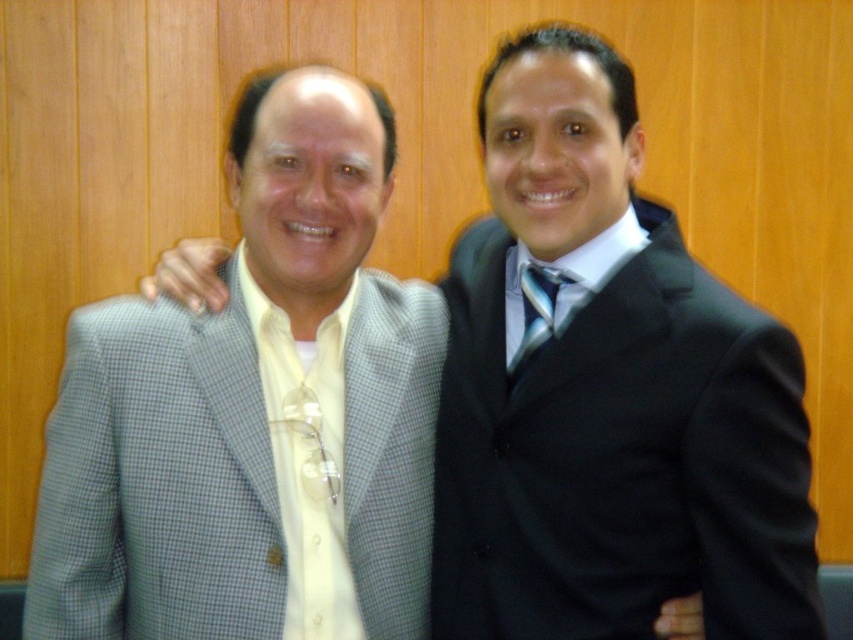
Is point (378, 205) closer to viewer compared to point (503, 499)?

No, it is behind (503, 499).

Can you confirm if gray checkered suit at left is thinner than black satin suit at right?

Incorrect, gray checkered suit at left's width is not less than black satin suit at right's.

Is point (90, 381) closer to viewer compared to point (675, 234)?

Yes, point (90, 381) is in front of point (675, 234).

The width and height of the screenshot is (853, 640). In order to click on gray checkered suit at left in this screenshot , I will do `click(254, 412)`.

Which is above, black satin suit at right or shiny blue tie at center?

shiny blue tie at center is above.

Is black satin suit at right below shiny blue tie at center?

Indeed, black satin suit at right is positioned under shiny blue tie at center.

Between point (651, 605) and point (514, 368), which one is positioned behind?

Point (514, 368)

This screenshot has height=640, width=853. I want to click on black satin suit at right, so click(x=619, y=458).

Can you confirm if gray checkered suit at left is thinner than shiny blue tie at center?

No, gray checkered suit at left is not thinner than shiny blue tie at center.

Can you confirm if gray checkered suit at left is bigger than shiny blue tie at center?

Yes, gray checkered suit at left is bigger than shiny blue tie at center.

Which is in front, point (370, 365) or point (524, 268)?

Point (370, 365) is in front.

In order to click on gray checkered suit at left in this screenshot , I will do `click(254, 412)`.